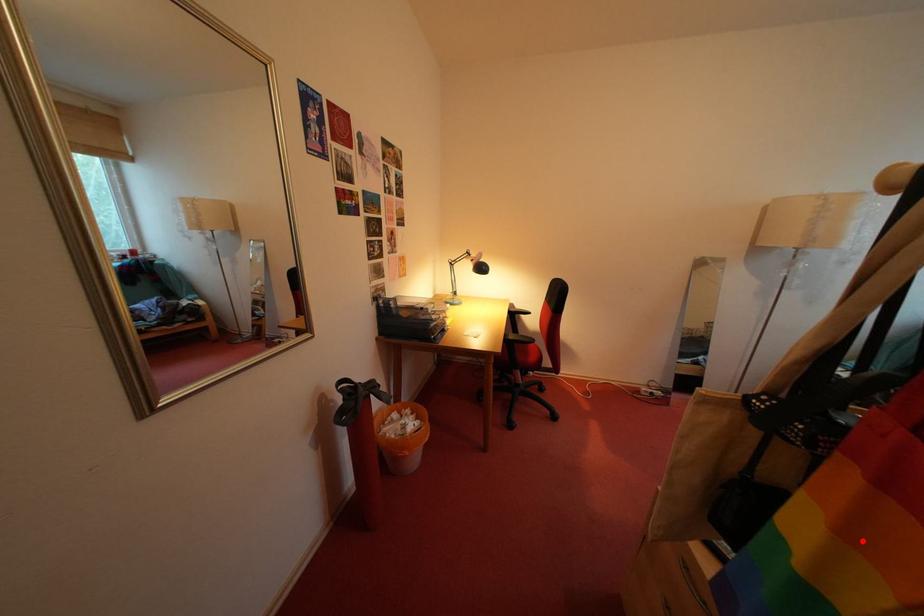
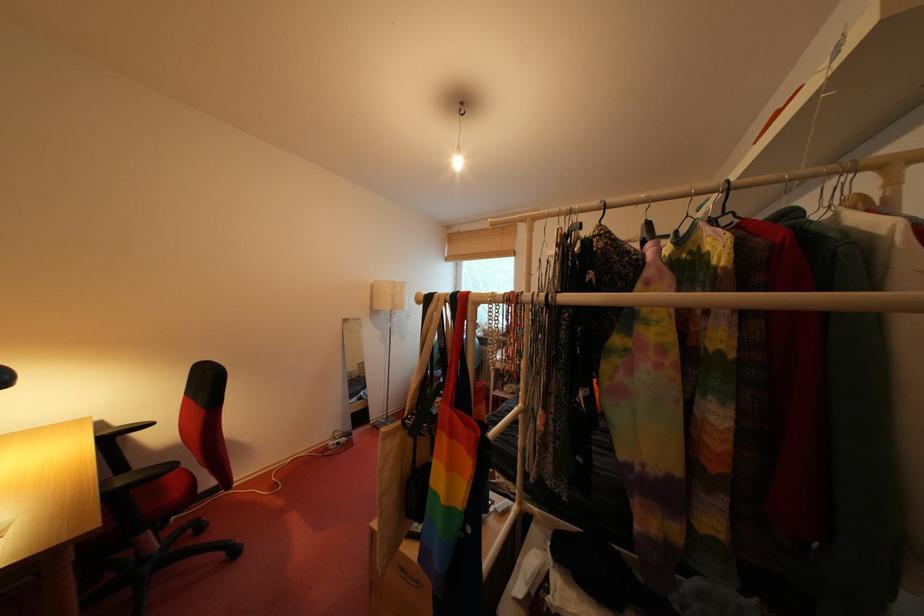
Locate, in the second image, the point that corresponds to the highlighted location in the first image.

(462, 472)